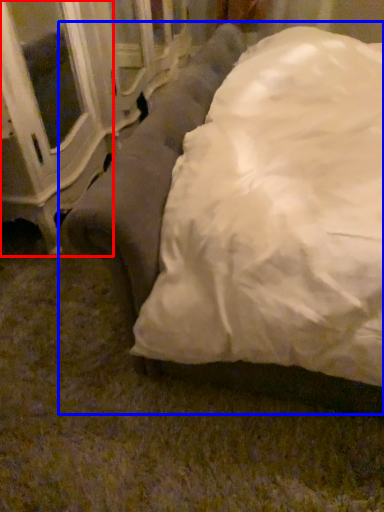
Question: Among these objects, which one is nearest to the camera, furniture (highlighted by a red box) or studio couch (highlighted by a blue box)?

Choices:
 (A) furniture
 (B) studio couch

Answer: (B)